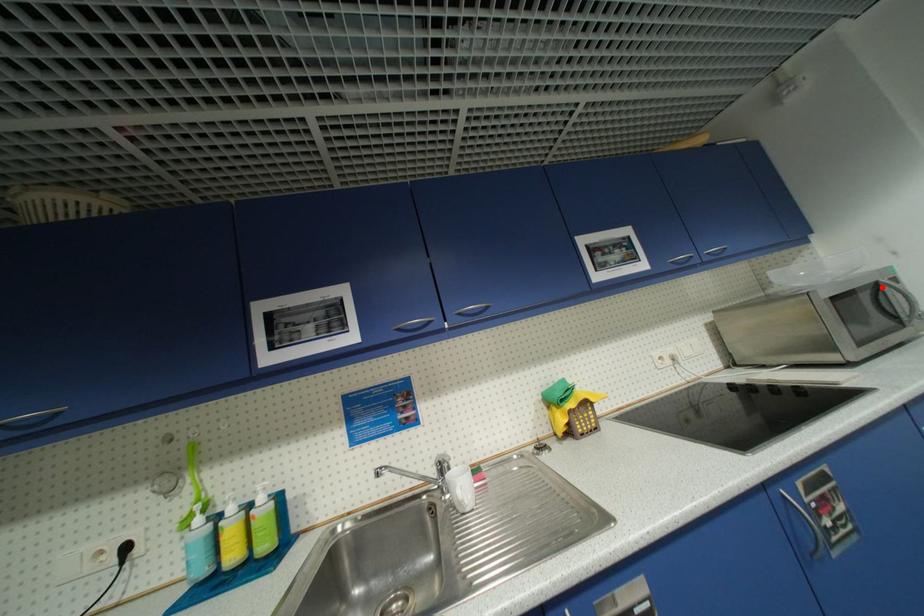
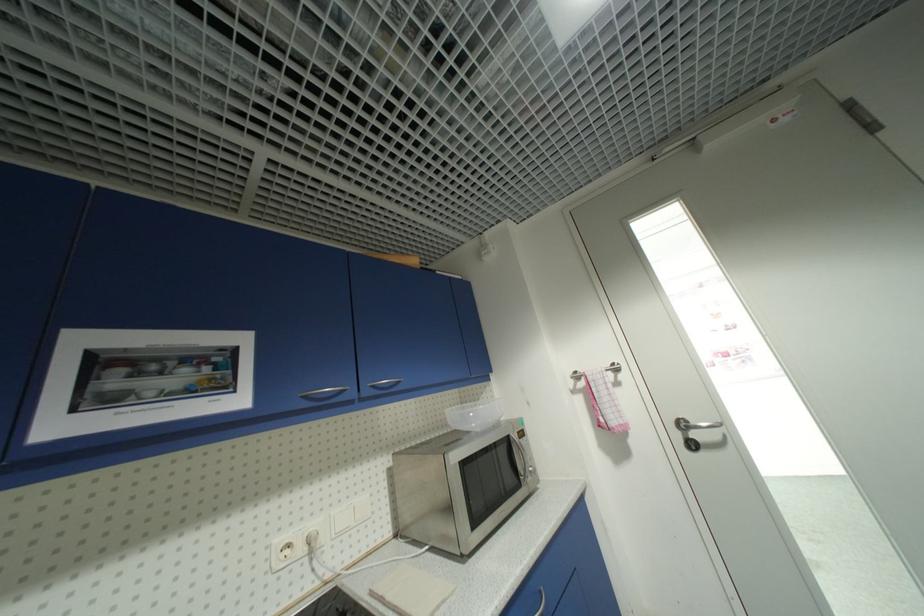
Question: I am providing you with two images of the same scene from different viewpoints. In image1, a red point is highlighted. Considering the same 3D point in image2, which of the following is correct?

Choices:
 (A) It is closer
 (B) It is farther

Answer: (B)